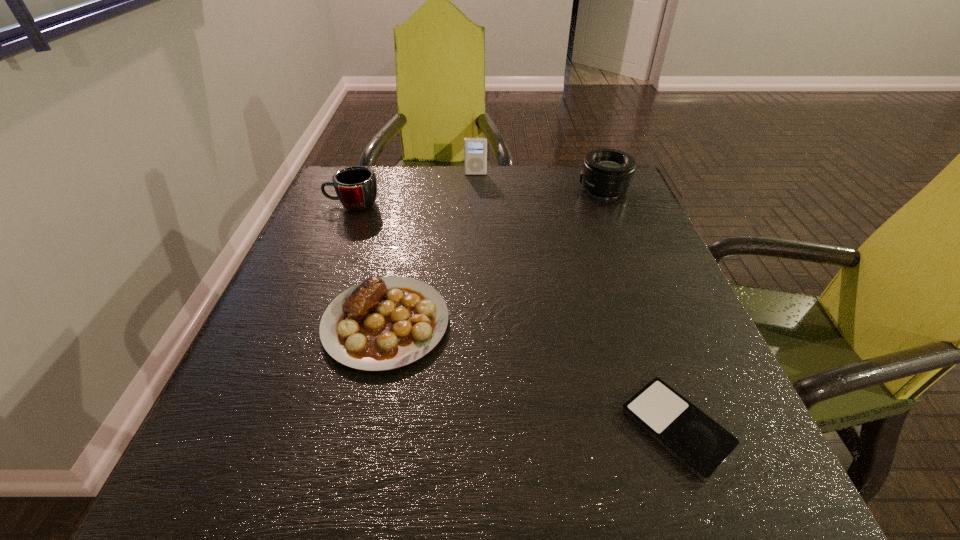
Where is `free space that is in between the telephoto lens and the taller iPod`? free space that is in between the telephoto lens and the taller iPod is located at coordinates (540, 181).

Locate an element on the screen. vacant area between the shorter iPod and the mug is located at coordinates (515, 316).

Image resolution: width=960 pixels, height=540 pixels. I want to click on free area in between the nearest object and the telephoto lens, so click(x=640, y=308).

The image size is (960, 540). Identify the location of free space that is in between the fourth farthest object and the nearer iPod. tap(531, 375).

Locate an element on the screen. Image resolution: width=960 pixels, height=540 pixels. free space between the telephoto lens and the mug is located at coordinates (478, 197).

Where is `unoccupied area between the second nearest object and the telephoto lens`? This screenshot has height=540, width=960. unoccupied area between the second nearest object and the telephoto lens is located at coordinates (494, 256).

The image size is (960, 540). Find the location of `vacant region between the mug and the steak`. vacant region between the mug and the steak is located at coordinates (370, 264).

The width and height of the screenshot is (960, 540). Identify the location of vacant space in between the taller iPod and the telephoto lens. (540, 181).

Where is `free space between the second nearest object and the mug`? This screenshot has width=960, height=540. free space between the second nearest object and the mug is located at coordinates (370, 264).

This screenshot has width=960, height=540. What are the coordinates of `free spot between the farthest object and the telephoto lens` in the screenshot? It's located at (540, 181).